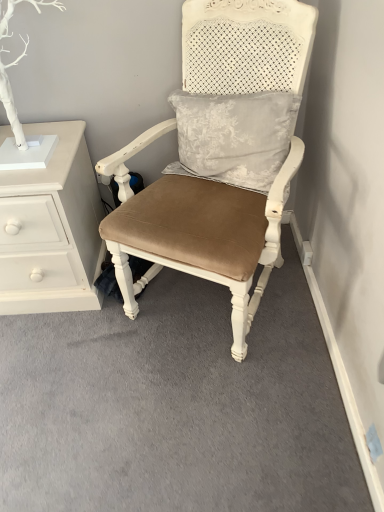
Locate an element on the screen. This screenshot has height=512, width=384. vacant area that is in front of suede-like tan cushion at center is located at coordinates (209, 412).